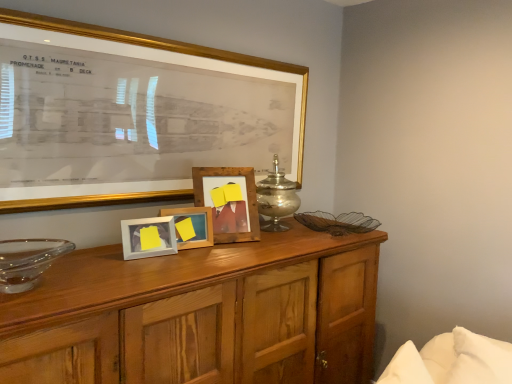
Question: Are wooden photo frame at center, the 3th picture frame from the front, and wooden cabinet at center far apart?

Choices:
 (A) no
 (B) yes

Answer: (A)

Question: From the image's perspective, would you say wooden photo frame at center, marked as the second picture frame in a back-to-front arrangement, is positioned over wooden cabinet at center?

Choices:
 (A) yes
 (B) no

Answer: (A)

Question: Is the surface of wooden photo frame at center, marked as the second picture frame in a back-to-front arrangement, in direct contact with wooden cabinet at center?

Choices:
 (A) yes
 (B) no

Answer: (B)

Question: Is wooden photo frame at center, the 3th picture frame from the front, shorter than wooden cabinet at center?

Choices:
 (A) yes
 (B) no

Answer: (A)

Question: From a real-world perspective, is wooden photo frame at center, the 3th picture frame from the front, on wooden cabinet at center?

Choices:
 (A) yes
 (B) no

Answer: (A)

Question: Considering the positions of gold framed picture at upper center, placed as the fourth picture frame when sorted from back to front, and wooden cabinet at center in the image, is gold framed picture at upper center, placed as the fourth picture frame when sorted from back to front, taller or shorter than wooden cabinet at center?

Choices:
 (A) tall
 (B) short

Answer: (B)

Question: Considering the positions of point (303, 127) and point (340, 291), is point (303, 127) closer or farther from the camera than point (340, 291)?

Choices:
 (A) farther
 (B) closer

Answer: (A)

Question: Which is correct: gold framed picture at upper center, placed as the fourth picture frame when sorted from back to front, is inside wooden cabinet at center, or outside of it?

Choices:
 (A) inside
 (B) outside

Answer: (B)

Question: Considering the relative positions of gold framed picture at upper center, the 1th picture frame viewed from the front, and wooden cabinet at center in the image provided, is gold framed picture at upper center, the 1th picture frame viewed from the front, to the left or to the right of wooden cabinet at center?

Choices:
 (A) left
 (B) right

Answer: (A)

Question: From the image's perspective, is transparent glass bowl at left positioned above or below gold framed picture at upper center, the 1th picture frame viewed from the front?

Choices:
 (A) below
 (B) above

Answer: (A)

Question: Would you say transparent glass bowl at left is to the left or to the right of gold framed picture at upper center, the 1th picture frame viewed from the front, in the picture?

Choices:
 (A) right
 (B) left

Answer: (B)

Question: Based on their sizes in the image, would you say transparent glass bowl at left is bigger or smaller than gold framed picture at upper center, the 1th picture frame viewed from the front?

Choices:
 (A) big
 (B) small

Answer: (B)

Question: From their relative heights in the image, would you say transparent glass bowl at left is taller or shorter than gold framed picture at upper center, placed as the fourth picture frame when sorted from back to front?

Choices:
 (A) short
 (B) tall

Answer: (A)

Question: Considering the positions of wooden photo frame at center, which is the 4th picture frame from front to back, and transparent glass bowl at left in the image, is wooden photo frame at center, which is the 4th picture frame from front to back, taller or shorter than transparent glass bowl at left?

Choices:
 (A) short
 (B) tall

Answer: (B)

Question: Is wooden photo frame at center, the first picture frame when ordered from back to front, in front of or behind transparent glass bowl at left in the image?

Choices:
 (A) behind
 (B) front

Answer: (A)